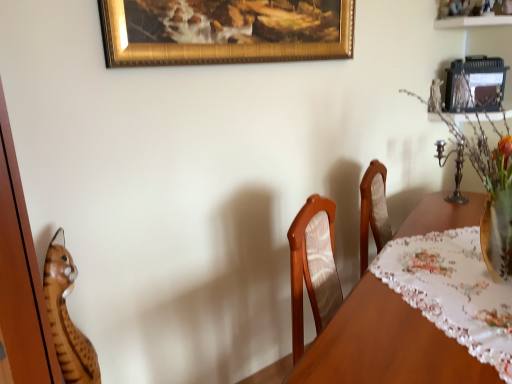
What do you see at coordinates (67, 317) in the screenshot? The image size is (512, 384). I see `wooden tiger at left` at bounding box center [67, 317].

Where is `wooden table at center`? The width and height of the screenshot is (512, 384). wooden table at center is located at coordinates (386, 345).

This screenshot has width=512, height=384. Find the location of `translucent glass vase with colorful flowers at right`. translucent glass vase with colorful flowers at right is located at coordinates (487, 184).

The height and width of the screenshot is (384, 512). I want to click on wooden tiger at left, so click(67, 317).

Considering the sizes of wooden tiger at left and translucent glass vase with colorful flowers at right in the image, is wooden tiger at left wider or thinner than translucent glass vase with colorful flowers at right?

wooden tiger at left is thinner than translucent glass vase with colorful flowers at right.

Considering the relative positions of wooden tiger at left and translucent glass vase with colorful flowers at right in the image provided, is wooden tiger at left to the right of translucent glass vase with colorful flowers at right from the viewer's perspective?

Incorrect, wooden tiger at left is not on the right side of translucent glass vase with colorful flowers at right.

Is the depth of wooden tiger at left less than that of translucent glass vase with colorful flowers at right?

No, wooden tiger at left is further to the viewer.

From a real-world perspective, is wooden table at center below gold textured frame at upper center?

Yes.

Considering the relative sizes of wooden table at center and gold textured frame at upper center in the image provided, is wooden table at center thinner than gold textured frame at upper center?

No.

Can you tell me how much wooden table at center and gold textured frame at upper center differ in facing direction?

wooden table at center and gold textured frame at upper center are facing 19.6 degrees away from each other.

Can you confirm if wooden table at center is shorter than gold textured frame at upper center?

In fact, wooden table at center may be taller than gold textured frame at upper center.

Is gold textured frame at upper center next to wooden tiger at left and touching it?

No, gold textured frame at upper center is not making contact with wooden tiger at left.

Can you confirm if gold textured frame at upper center is taller than wooden tiger at left?

Incorrect, the height of gold textured frame at upper center is not larger of that of wooden tiger at left.

From a real-world perspective, is gold textured frame at upper center positioned above or below wooden tiger at left?

gold textured frame at upper center is situated higher than wooden tiger at left in the real world.

Is gold textured frame at upper center aimed at wooden tiger at left?

No, gold textured frame at upper center is not oriented towards wooden tiger at left.

Looking at this image, considering the relative sizes of wooden table at center and wooden tiger at left in the image provided, is wooden table at center thinner than wooden tiger at left?

No.

Is wooden table at center closer to the viewer compared to wooden tiger at left?

Yes.

Based on the photo, can wooden tiger at left be found inside wooden table at center?

No, wooden tiger at left is not inside wooden table at center.

How different are the orientations of wooden table at center and wooden tiger at left in degrees?

wooden table at center and wooden tiger at left are facing 19.6 degrees away from each other.

Is wooden tiger at left oriented away from wooden table at center?

wooden tiger at left does not have its back to wooden table at center.

From their relative heights in the image, would you say wooden tiger at left is taller or shorter than wooden table at center?

Clearly, wooden tiger at left is shorter compared to wooden table at center.

From a real-world perspective, is wooden tiger at left physically above wooden table at center?

Incorrect, from a real-world perspective, wooden tiger at left is lower than wooden table at center.

Is wooden tiger at left inside the boundaries of wooden table at center, or outside?

wooden tiger at left is not enclosed by wooden table at center.

Considering the points (63, 287) and (214, 5), which point is in front, point (63, 287) or point (214, 5)?

The point (63, 287) is closer.

Consider the image. Does wooden tiger at left come behind gold textured frame at upper center?

No, it is not.

From a real-world perspective, is wooden tiger at left over gold textured frame at upper center?

Actually, wooden tiger at left is physically below gold textured frame at upper center in the real world.

Which of these two, wooden tiger at left or gold textured frame at upper center, stands shorter?

gold textured frame at upper center.

Would you consider translucent glass vase with colorful flowers at right to be distant from wooden table at center?

No, there isn't a large distance between translucent glass vase with colorful flowers at right and wooden table at center.

From a real-world perspective, between translucent glass vase with colorful flowers at right and wooden table at center, who is vertically higher?

translucent glass vase with colorful flowers at right, from a real-world perspective.

Is translucent glass vase with colorful flowers at right at the right side of wooden table at center?

Yes.

In the image, there is a wooden tiger at left. Where is `floral arrangement above it (from the image's perspective)`? The image size is (512, 384). floral arrangement above it (from the image's perspective) is located at coordinates (487, 184).

Locate an element on the screen. This screenshot has width=512, height=384. picture frame that is on the left side of wooden table at center is located at coordinates (224, 31).

Based on their spatial positions, is wooden table at center or gold textured frame at upper center closer to wooden tiger at left?

wooden table at center is closer to wooden tiger at left.

Considering their positions, is wooden tiger at left positioned further to translucent glass vase with colorful flowers at right than gold textured frame at upper center?

Among the two, wooden tiger at left is located further to translucent glass vase with colorful flowers at right.

From the image, which object appears to be nearer to gold textured frame at upper center, wooden table at center or wooden tiger at left?

wooden tiger at left is positioned closer to the anchor gold textured frame at upper center.

When comparing their distances from translucent glass vase with colorful flowers at right, does wooden table at center or wooden tiger at left seem further?

wooden tiger at left lies further to translucent glass vase with colorful flowers at right than the other object.

Consider the image. When comparing their distances from gold textured frame at upper center, does wooden table at center or translucent glass vase with colorful flowers at right seem closer?

The object closer to gold textured frame at upper center is translucent glass vase with colorful flowers at right.

Looking at the image, which one is located closer to gold textured frame at upper center, wooden tiger at left or wooden table at center?

Based on the image, wooden tiger at left appears to be nearer to gold textured frame at upper center.

From the image, which object appears to be nearer to wooden table at center, translucent glass vase with colorful flowers at right or wooden tiger at left?

translucent glass vase with colorful flowers at right is closer to wooden table at center.

Looking at the image, which one is located further to gold textured frame at upper center, translucent glass vase with colorful flowers at right or wooden table at center?

The object further to gold textured frame at upper center is wooden table at center.

You are a GUI agent. You are given a task and a screenshot of the screen. Output one action in this format:
    pyautogui.click(x=<x>, y=<y>)
    Task: Click on the picture frame between wooden tiger at left and translucent glass vase with colorful flowers at right from left to right
    This screenshot has height=384, width=512.
    Given the screenshot: What is the action you would take?
    pyautogui.click(x=224, y=31)

Identify the location of floral arrangement that lies between gold textured frame at upper center and wooden table at center from top to bottom. The width and height of the screenshot is (512, 384). (487, 184).

I want to click on table between gold textured frame at upper center and wooden tiger at left from top to bottom, so click(386, 345).

Locate an element on the screen. This screenshot has width=512, height=384. table situated between wooden tiger at left and translucent glass vase with colorful flowers at right from left to right is located at coordinates (386, 345).